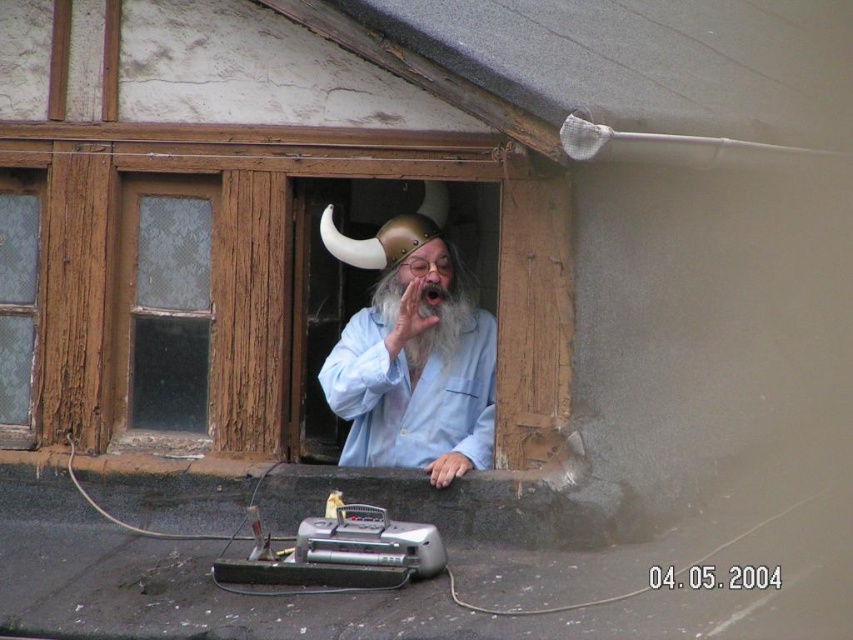
You are a photographer trying to capture the matte gold helmet at center and the clear glass window at left in the same frame. Based on their sizes, which object will occupy more space in your photo?

The matte gold helmet at center will occupy more space in the photo because its width surpasses that of the clear glass window at left, making it larger in the frame.

Consider the image. You are a delivery person who needs to place a package between the matte gold helmet at center and the clear glass door at left. The package measures 1.2 meters in length. Will there be enough space to fit it between them?

The distance between the matte gold helmet at center and the clear glass door at left is 1.13 meters. Since the package is 1.2 meters long, it will not fit in the available space.